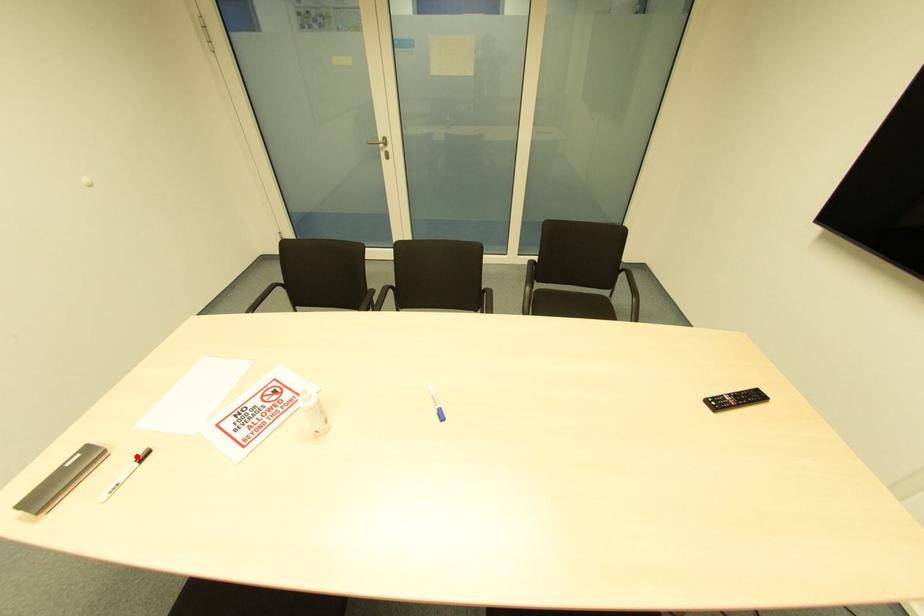
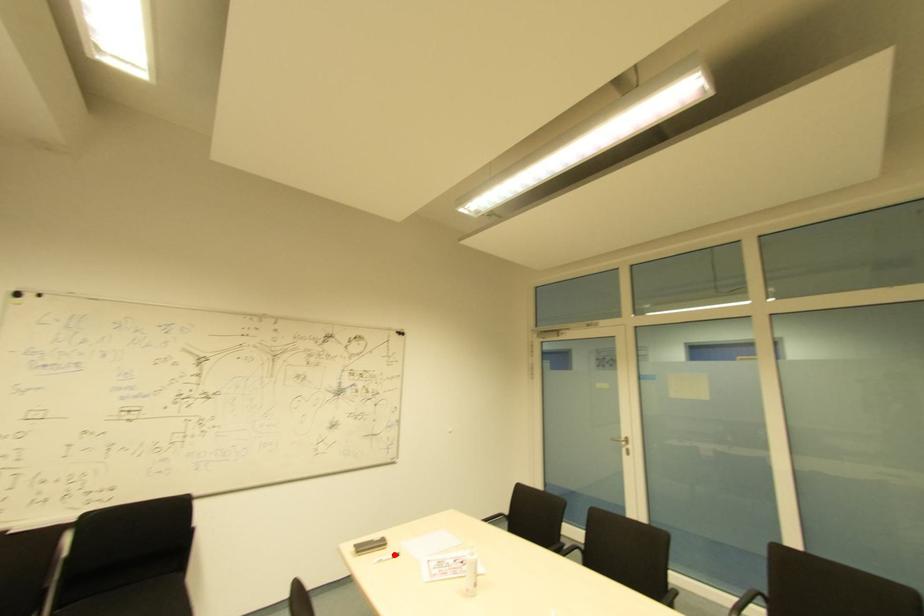
I am providing you with two images of the same scene from different viewpoints. A red point is marked on the first image and another point is marked on the second image. Do the highlighted points in image1 and image2 indicate the same real-world spot?

Yes